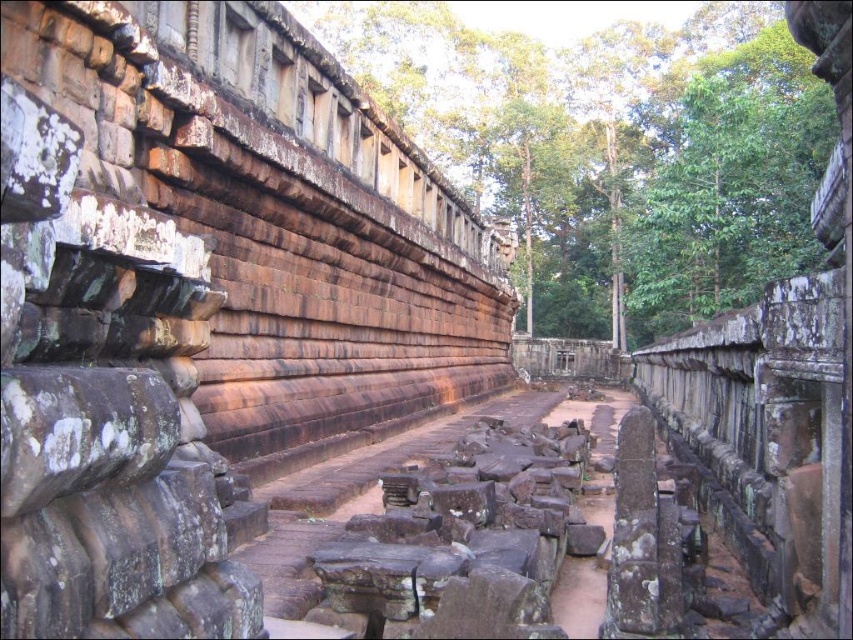
Who is more forward, (762, 403) or (341, 536)?

Positioned in front is point (762, 403).

Is point (811, 284) farther from camera compared to point (422, 582)?

No, it is in front of (422, 582).

This screenshot has width=853, height=640. What are the coordinates of `weathered stone railing at upper center` in the screenshot? It's located at (779, 388).